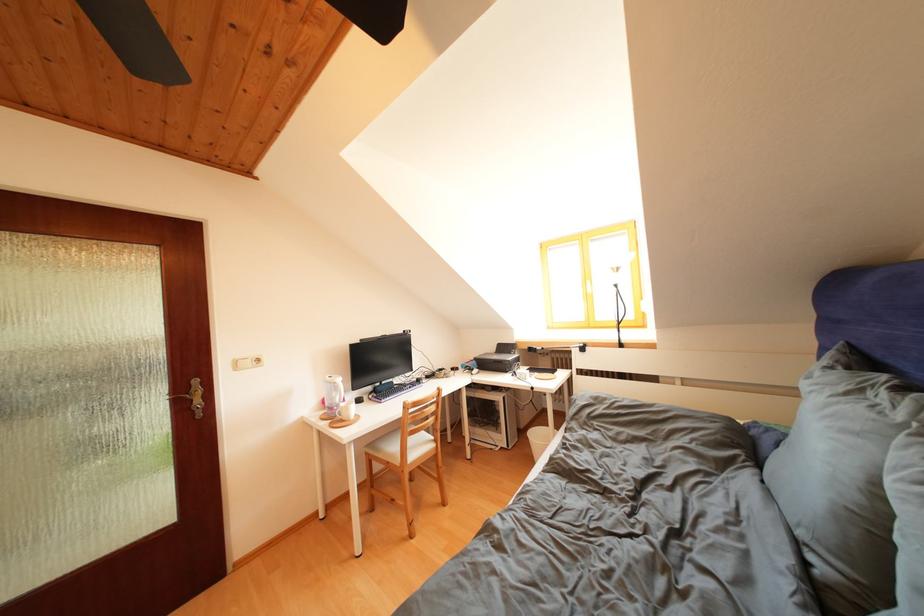
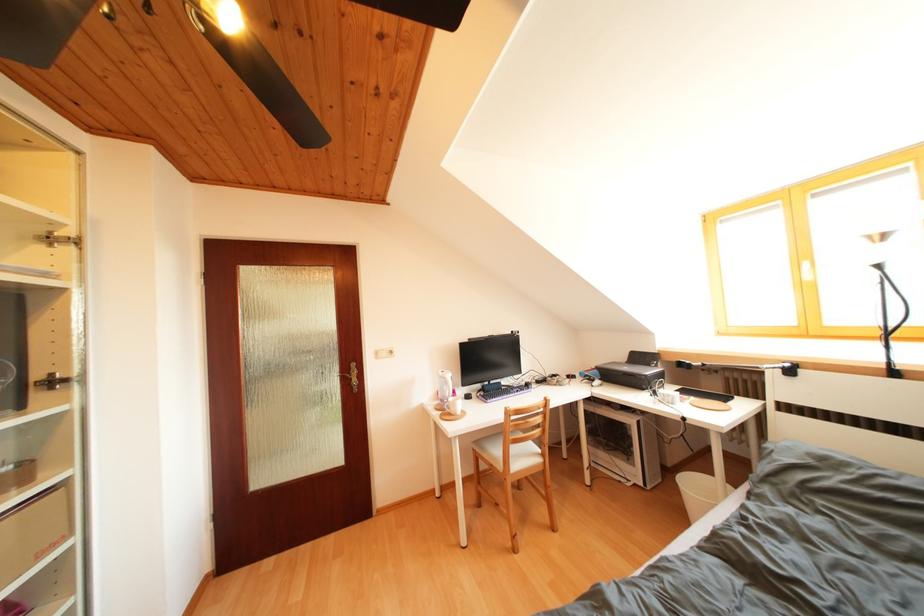
What movement of the cameraman would produce the second image?

The movement direction of the cameraman is right, forward.